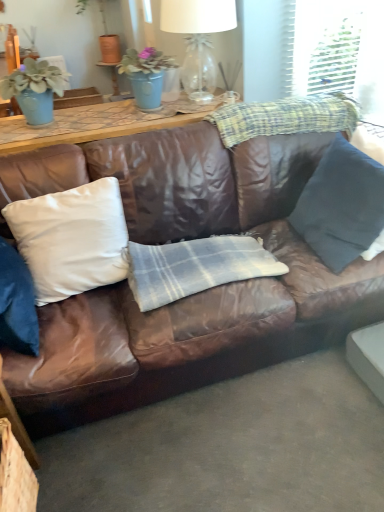
Question: From the image's perspective, relative to clear glass lampshade at upper center, is dark blue fabric pillow at right, the second pillow when ordered from left to right, above or below?

Choices:
 (A) below
 (B) above

Answer: (A)

Question: From their relative heights in the image, would you say dark blue fabric pillow at right, placed as the 1th pillow when sorted from right to left, is taller or shorter than clear glass lampshade at upper center?

Choices:
 (A) short
 (B) tall

Answer: (B)

Question: Considering the real-world distances, which object is farthest from the plaid fabric at upper right, which ranks as the 1th plaid in top-to-bottom order?

Choices:
 (A) matte blue pot at upper center, the second houseplant from the left
 (B) white satin pillow at center, the first pillow in the left-to-right sequence
 (C) dark blue fabric pillow at right, placed as the 1th pillow when sorted from right to left
 (D) plaid fabric at center, acting as the 2th plaid starting from the top
 (E) brown leather couch at center

Answer: (B)

Question: Estimate the real-world distances between objects in this image. Which object is closer to the clear glass lampshade at upper center?

Choices:
 (A) brown leather couch at center
 (B) white satin pillow at center, which is the 2th pillow from right to left
 (C) matte blue pot at upper center, arranged as the first houseplant when viewed from the right
 (D) plaid fabric at center, acting as the 2th plaid starting from the top
 (E) plaid fabric at upper right, the second plaid in the bottom-to-top sequence

Answer: (C)